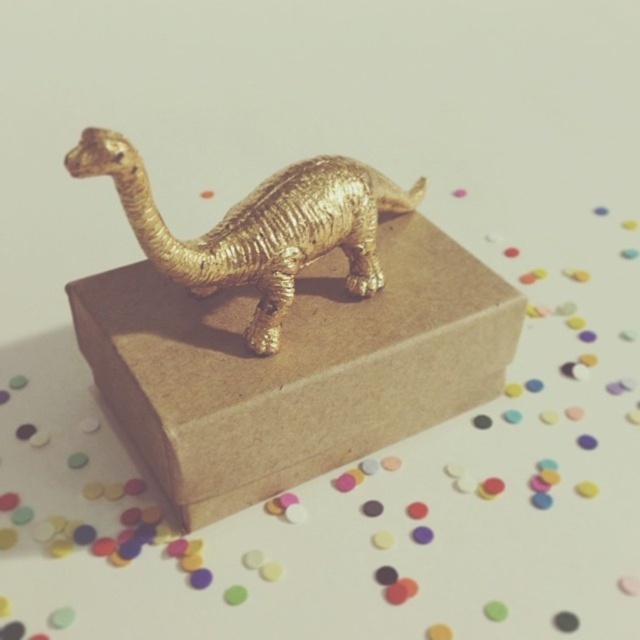
You are trying to place a new sticker on the surface between the brown cardboard box at center and the gold textured dinosaur at center. Can you fit the sticker there?

The brown cardboard box at center might be wider than gold textured dinosaur at center, so there might not be enough space between them to place the sticker.

You are organizing a display and have a brown cardboard box at center and a gold textured dinosaur at center. Which object should you place first to ensure the dinosaur stays on top without falling off?

You should place the brown cardboard box at center first because it is larger and provides a stable base for the gold textured dinosaur at center to stay on top without falling off.